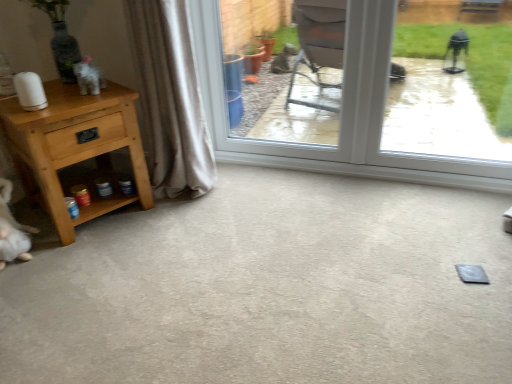
The image size is (512, 384). Identify the location of vacant space in front of light brown wood nightstand at left. (84, 267).